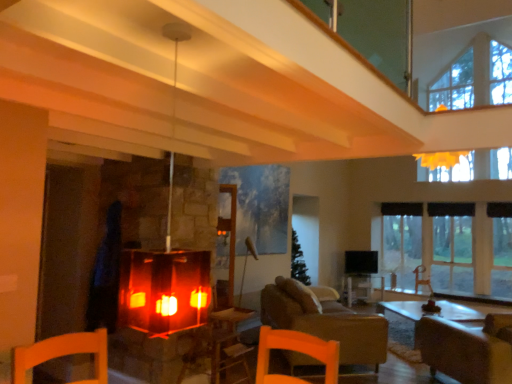
Question: Is wooden table at center taller or shorter than matte glass fireplace at center?

Choices:
 (A) tall
 (B) short

Answer: (B)

Question: Is point (346, 284) positioned closer to the camera than point (159, 266)?

Choices:
 (A) farther
 (B) closer

Answer: (A)

Question: Which of these objects is positioned closest to the leather couch at center?

Choices:
 (A) brown leather armchair at lower right, the second armchair from the front
 (B) black fabric curtain at right
 (C) transparent glass window at right
 (D) wooden table at center
 (E) brown leather armchair at lower right, the second armchair positioned from the right

Answer: (E)

Question: Estimate the real-world distances between objects in this image. Which object is closer to the leather couch at center?

Choices:
 (A) brown leather armchair at lower right, the second armchair positioned from the right
 (B) brown leather armchair at lower right, the second armchair from the front
 (C) black fabric curtain at right
 (D) matte glass fireplace at center
 (E) wooden table at center

Answer: (A)